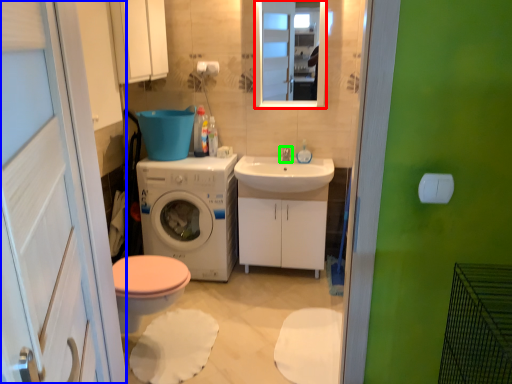
Question: Estimate the real-world distances between objects in this image. Which object is farther from mirror (highlighted by a red box), screen door (highlighted by a blue box) or tap (highlighted by a green box)?

Choices:
 (A) screen door
 (B) tap

Answer: (A)